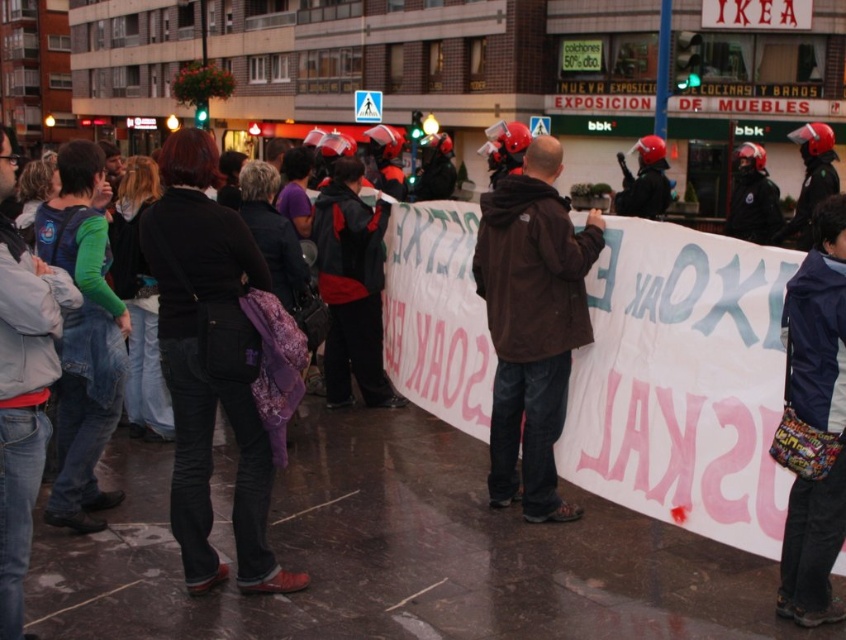
You are a photographer trying to capture a clear shot of the banner. You notice two jackets in the frame, a brown fabric jacket at center and a navy blue fabric jacket at lower right. Which jacket might be blocking the banner more due to its size?

The brown fabric jacket at center is bigger than the navy blue fabric jacket at lower right, so it is likely blocking the banner more due to its larger size.

You are a photographer trying to capture a clear shot of the navy blue fabric jacket at lower right. However, the brown fabric jacket at center is blocking your view. Can you move around to the left side to get an unobstructed view?

The navy blue fabric jacket at lower right is behind the brown fabric jacket at center, so moving to the left side might not help as the brown fabric jacket at center is still blocking the view. You might need to move to the right side instead.